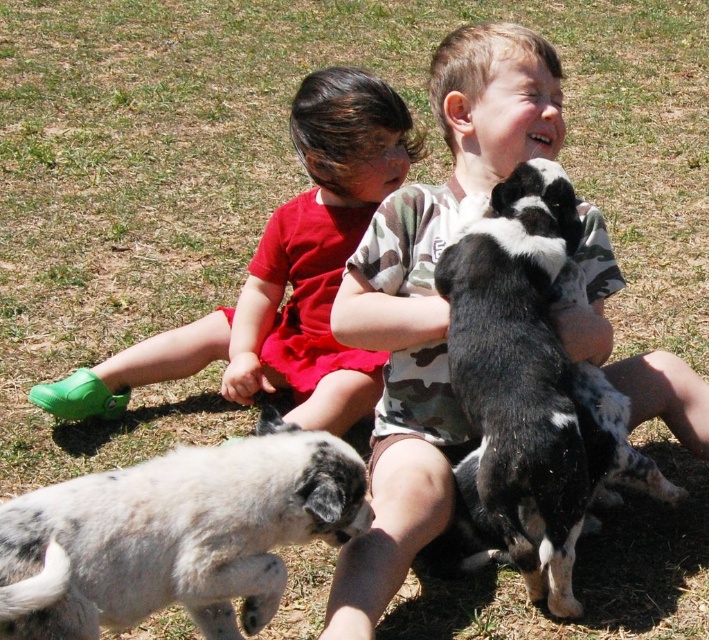
Question: Is speckled fur puppy at lower left below matte red dress at left?

Choices:
 (A) yes
 (B) no

Answer: (A)

Question: Which object is the farthest from the black and white fur at upper center?

Choices:
 (A) matte red dress at left
 (B) speckled fur puppy at lower left

Answer: (A)

Question: Which point is closer to the camera?

Choices:
 (A) click(368, 77)
 (B) click(471, 280)

Answer: (B)

Question: Does speckled fur puppy at lower left appear under black and white fur at upper center?

Choices:
 (A) no
 (B) yes

Answer: (B)

Question: Is the position of speckled fur puppy at lower left more distant than that of matte red dress at left?

Choices:
 (A) no
 (B) yes

Answer: (A)

Question: Estimate the real-world distances between objects in this image. Which object is farther from the camouflage fabric shirt at center?

Choices:
 (A) speckled fur puppy at lower left
 (B) matte red dress at left
 (C) black and white fur at upper center

Answer: (B)